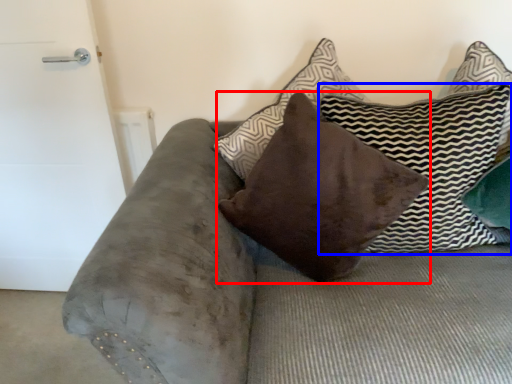
Question: Among these objects, which one is farthest to the camera, pillow (highlighted by a red box) or pillow (highlighted by a blue box)?

Choices:
 (A) pillow
 (B) pillow

Answer: (A)